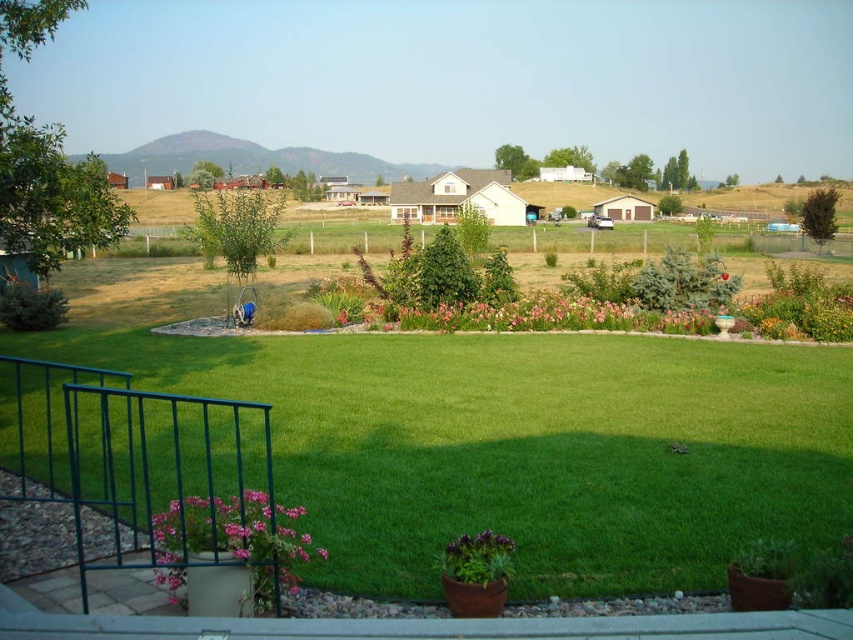
Does point (686, 552) come behind point (279, 589)?

Yes, it is behind point (279, 589).

Is green grass at center smaller than pink matte flower at lower center?

No, green grass at center is not smaller than pink matte flower at lower center.

Image resolution: width=853 pixels, height=640 pixels. What do you see at coordinates (526, 445) in the screenshot?
I see `green grass at center` at bounding box center [526, 445].

Where is `green grass at center`? green grass at center is located at coordinates (526, 445).

Can you confirm if green metal railing at lower left is taller than purple matte flower at center?

Correct, green metal railing at lower left is much taller as purple matte flower at center.

Can you confirm if green metal railing at lower left is shorter than purple matte flower at center?

No.

Who is more distant from viewer, (38, 371) or (485, 541)?

The point (38, 371) is more distant.

This screenshot has height=640, width=853. In order to click on green metal railing at lower left in this screenshot , I will do `click(128, 456)`.

Image resolution: width=853 pixels, height=640 pixels. Describe the element at coordinates (234, 540) in the screenshot. I see `pink matte flower at lower center` at that location.

Does point (177, 579) come in front of point (465, 541)?

Yes, it is.

Is point (241, 506) positioned after point (496, 547)?

No, (241, 506) is closer to viewer.

Locate an element on the screen. pink matte flower at lower center is located at coordinates (234, 540).